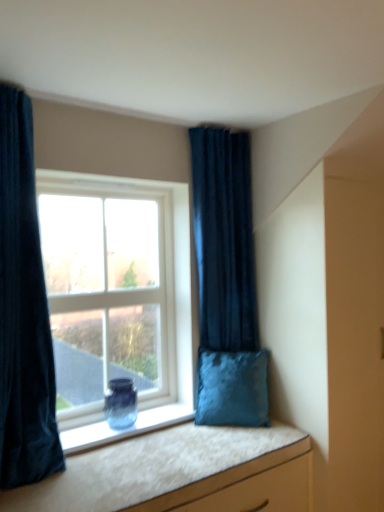
Locate an element on the screen. The image size is (384, 512). spots to the right of velvet dark blue curtain at left, acting as the first curtain starting from the left is located at coordinates (107, 480).